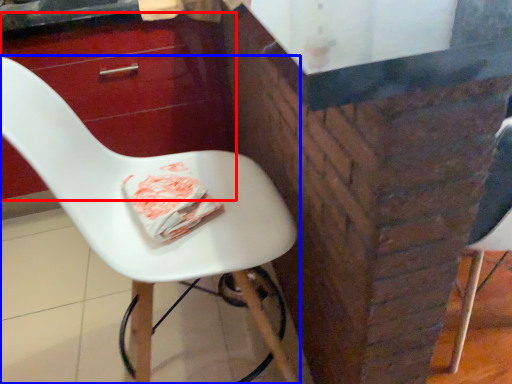
Question: Which point is closer to the camera, drawer (highlighted by a red box) or chair (highlighted by a blue box)?

Choices:
 (A) drawer
 (B) chair

Answer: (B)